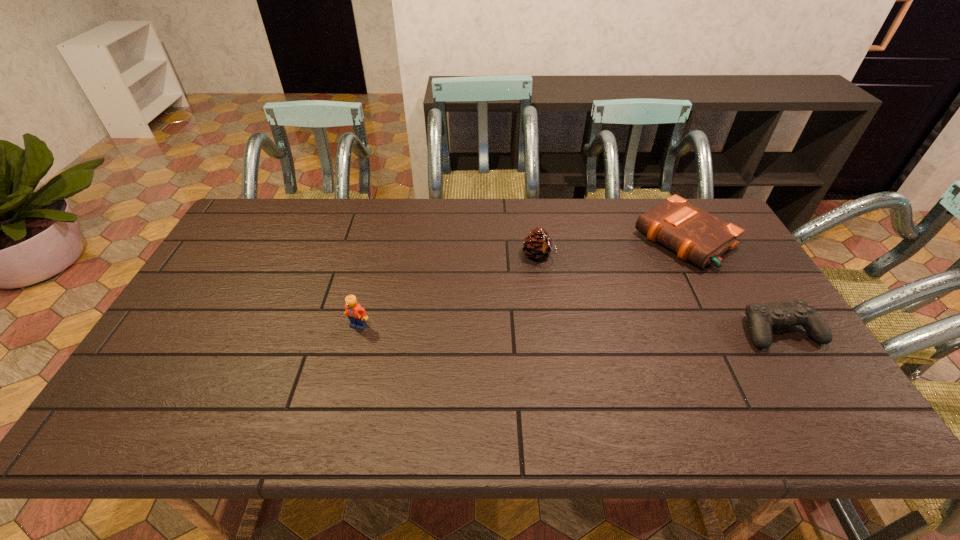
The width and height of the screenshot is (960, 540). In order to click on free spot on the desktop that is between the leftmost object and the control and is positioned on the spine side of the Bible in this screenshot , I will do `click(545, 328)`.

What are the coordinates of `free spot on the desktop that is between the leftmost object and the control and is positioned with a leaf charm attached to the second object from left to right` in the screenshot? It's located at (601, 328).